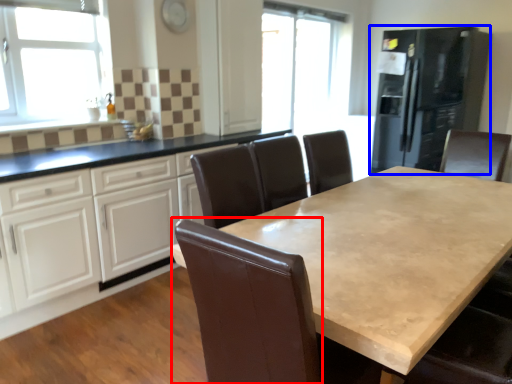
Question: Among these objects, which one is nearest to the camera, swivel chair (highlighted by a red box) or fridge (highlighted by a blue box)?

Choices:
 (A) swivel chair
 (B) fridge

Answer: (A)